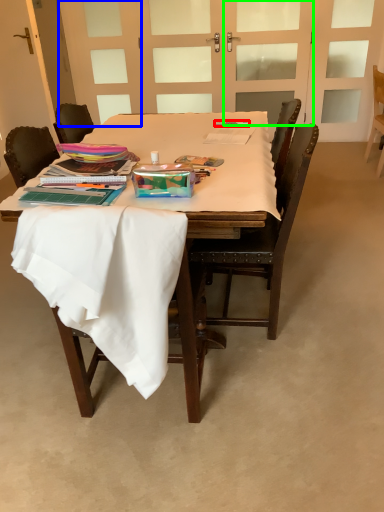
Question: Which is nearer to the pen (highlighted by a red box)? door (highlighted by a blue box) or screen door (highlighted by a green box).

Choices:
 (A) door
 (B) screen door

Answer: (B)